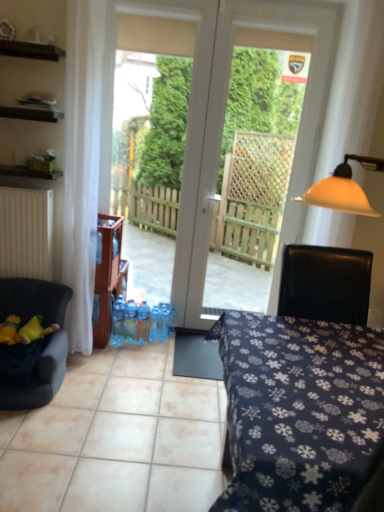
Find the location of a particular element. space that is in front of blue plastic bottle at center, the second bottle positioned from the left is located at coordinates (130, 351).